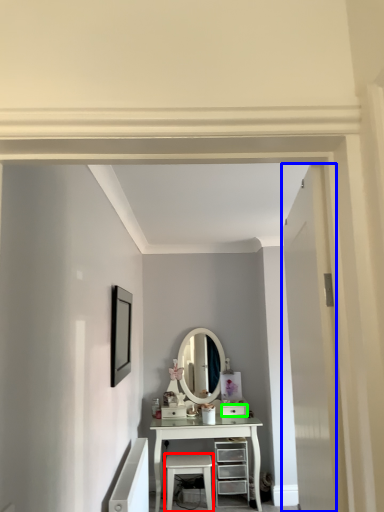
Question: Which is nearer to the stool (highlighted by a red box)? door (highlighted by a blue box) or drawer (highlighted by a green box).

Choices:
 (A) door
 (B) drawer

Answer: (B)